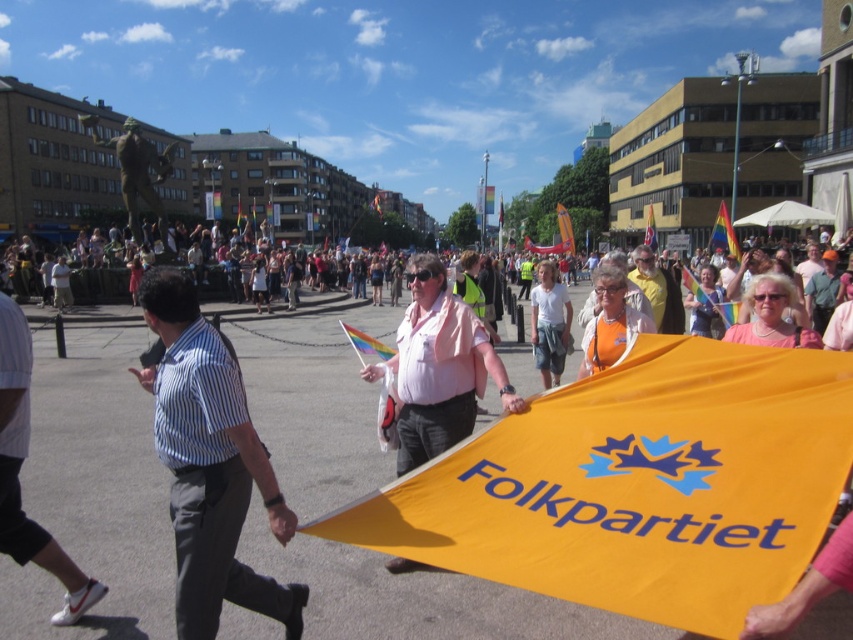
Which is behind, point (231, 353) or point (711, 244)?

Point (711, 244)

Does blue striped shirt at center have a greater height compared to rainbow fabric flag at upper center?

No.

I want to click on blue striped shirt at center, so click(209, 465).

Which is in front, point (605, 291) or point (547, 278)?

Point (605, 291) is more forward.

Who is positioned more to the left, orange fabric at center or white cotton t-shirt at center?

Positioned to the left is orange fabric at center.

Locate an element on the screen. orange fabric at center is located at coordinates (610, 323).

You are a GUI agent. You are given a task and a screenshot of the screen. Output one action in this format:
    pyautogui.click(x=<x>, y=<y>)
    Task: Click on the orange fabric at center
    
    Given the screenshot: What is the action you would take?
    pyautogui.click(x=610, y=323)

Can you confirm if white cotton t-shirt at center is shorter than rainbow fabric flag at upper center?

Indeed, white cotton t-shirt at center has a lesser height compared to rainbow fabric flag at upper center.

What do you see at coordinates (549, 323) in the screenshot?
I see `white cotton t-shirt at center` at bounding box center [549, 323].

Identify the location of white cotton t-shirt at center. This screenshot has height=640, width=853. (549, 323).